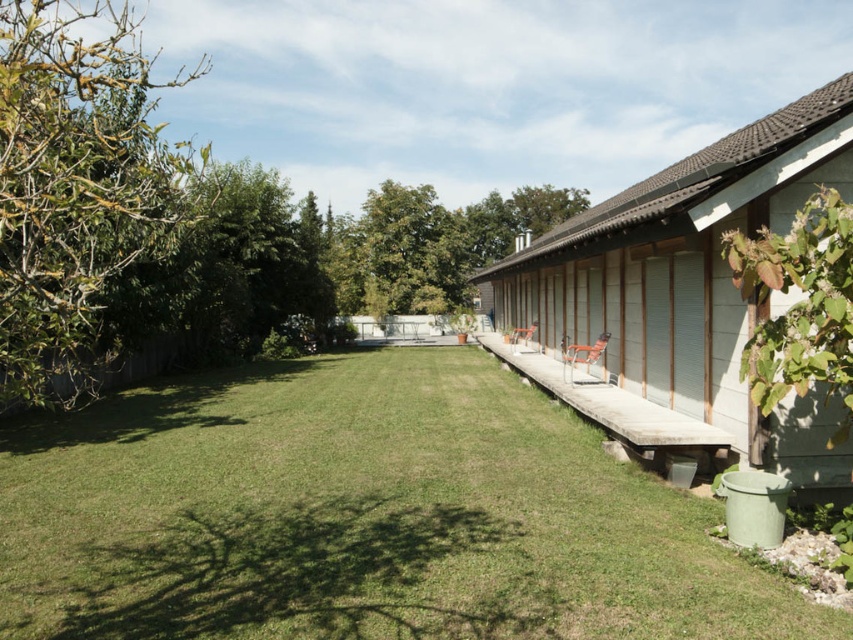
Which is behind, point (460, 465) or point (694, 352)?

Positioned behind is point (694, 352).

Who is shorter, green grass at center or white wood hut at right?

Standing shorter between the two is green grass at center.

The image size is (853, 640). Find the location of `green grass at center`. green grass at center is located at coordinates pyautogui.click(x=360, y=515).